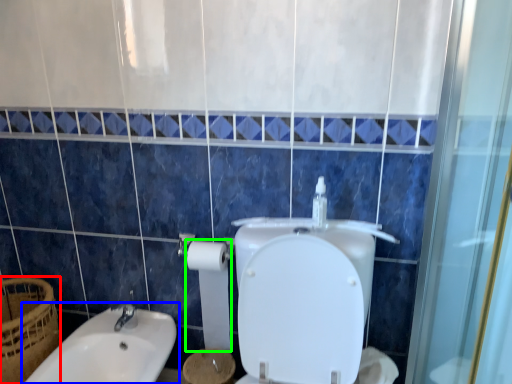
Question: Which object is the farthest from basket (highlighted by a red box)? Choose among these: sink (highlighted by a blue box) or toilet paper (highlighted by a green box).

Choices:
 (A) sink
 (B) toilet paper

Answer: (B)